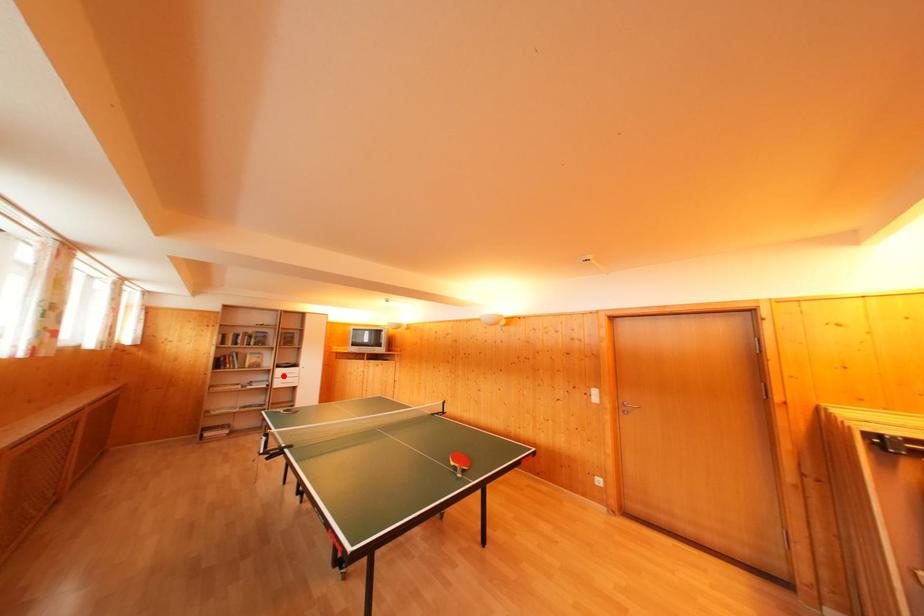
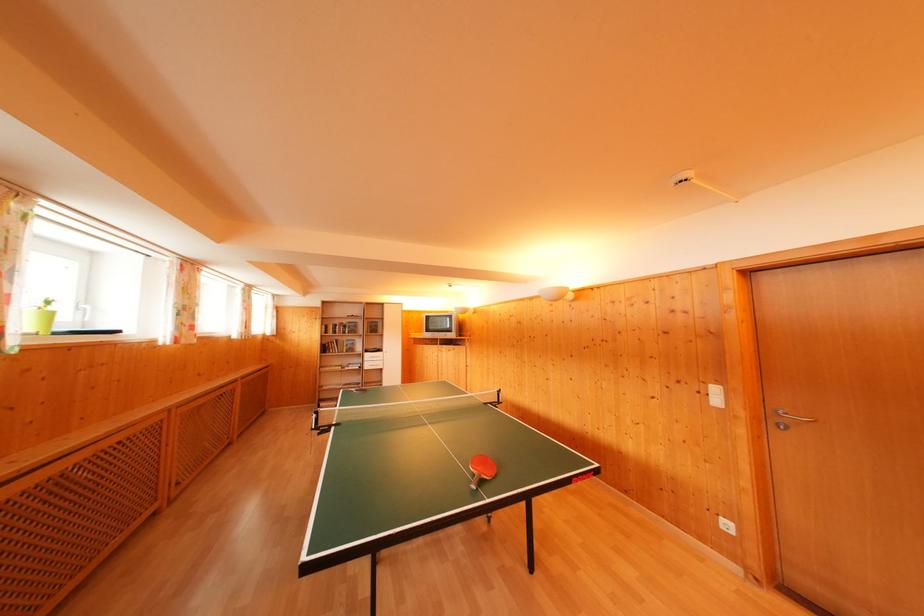
Find the pixel in the second image that matches the highlighted location in the first image.

(371, 360)